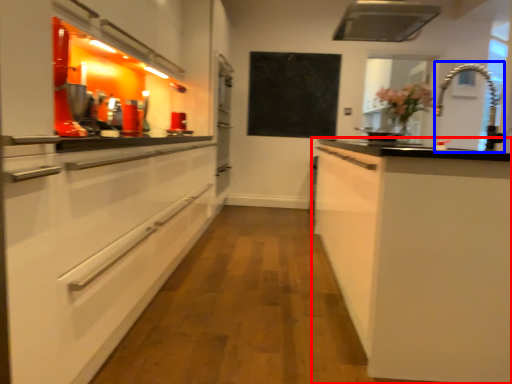
Question: Which of the following is the closest to the observer, cabinetry (highlighted by a red box) or faucet (highlighted by a blue box)?

Choices:
 (A) cabinetry
 (B) faucet

Answer: (A)